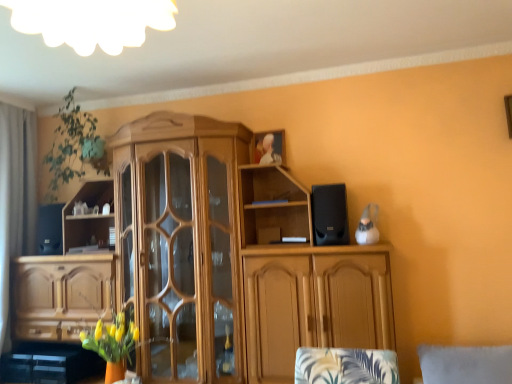
Image resolution: width=512 pixels, height=384 pixels. In order to click on empty space that is ontop of green leafy plant at upper left in this screenshot , I will do `click(68, 91)`.